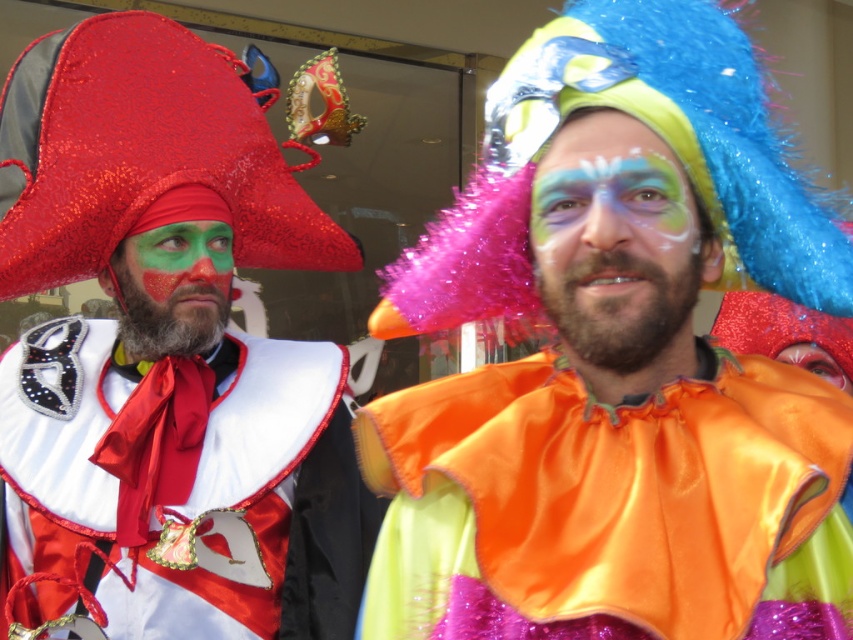
You are a photographer at a costume party and want to capture both the matte orange clown nose at center and the shiny orange fabric at center in your shot. Which object should you focus on first to ensure both are in frame?

You should focus on the shiny orange fabric at center first because the matte orange clown nose at center is above it, so adjusting the camera angle to include the lower object will naturally include the upper one as well.

You are a photographer trying to capture the shiny satin cape at left. You know that the camera lens has a focal point at coordinate point (177, 488). Will the shiny satin cape at left be in focus if you aim the camera at that point?

Yes, the point (177, 488) corresponds to the shiny satin cape at left, so aiming the camera at that point will ensure the shiny satin cape at left is in focus.